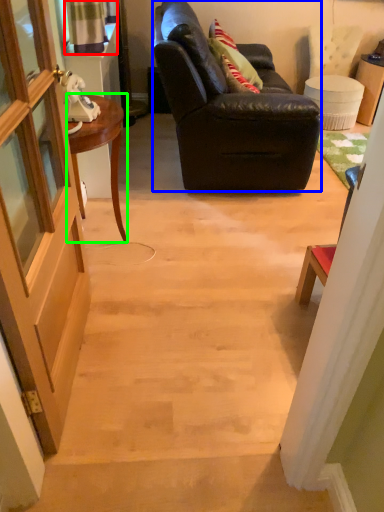
Question: Considering the real-world distances, which object is farthest from curtain (highlighted by a red box)? studio couch (highlighted by a blue box) or desk (highlighted by a green box)?

Choices:
 (A) studio couch
 (B) desk

Answer: (A)